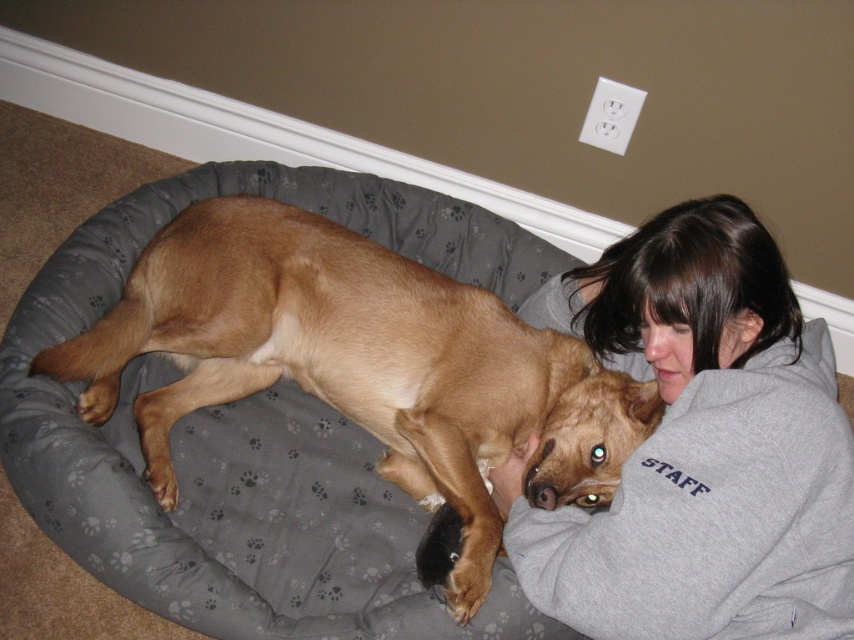
You are a delivery robot that needs to place a small package between the brown smooth dog at center and the gray fleece sweatshirt at upper right. The package is 10 inches long. Can you fit it between them without moving either object?

The distance between the brown smooth dog at center and the gray fleece sweatshirt at upper right is 10.97 inches. Since the package is 10 inches long, it can fit between them as the space is slightly larger than the package.

You are a pet store employee who needs to ensure the brown smooth dog at center can fit through a doorway. The doorway has a width equal to the gray fleece sweatshirt at upper right. Can the dog pass through the doorway?

The brown smooth dog at center is wider than the gray fleece sweatshirt at upper right, so the dog cannot pass through the doorway which is only as wide as the sweatshirt.

You are a photographer adjusting your camera to focus on two points in the scene. The first point is point [155,444] and the second point is point [664,364]. Which point is closer to your camera?

Point [155,444] is further to the camera than point [664,364], so the second point is closer to the camera.